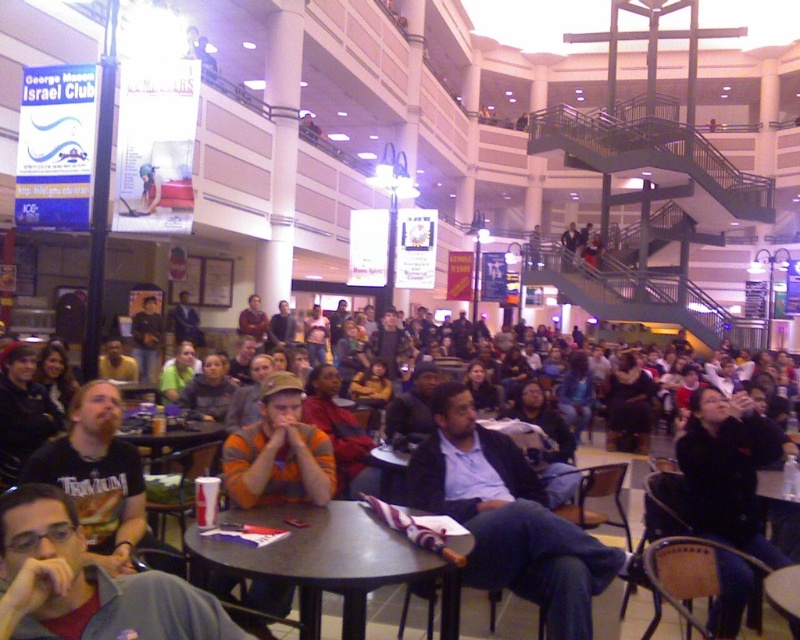
Does gray fabric shirt at lower left have a lesser height compared to black leather jacket at lower right?

Correct, gray fabric shirt at lower left is not as tall as black leather jacket at lower right.

Locate an element on the screen. The width and height of the screenshot is (800, 640). gray fabric shirt at lower left is located at coordinates (88, 582).

Image resolution: width=800 pixels, height=640 pixels. What do you see at coordinates (88, 582) in the screenshot?
I see `gray fabric shirt at lower left` at bounding box center [88, 582].

Find the location of `gray fabric shirt at lower left`. gray fabric shirt at lower left is located at coordinates (88, 582).

Does point (344, 609) come farther from viewer compared to point (725, 460)?

No, it is in front of (725, 460).

Consider the image. Can you confirm if metallic gray table at center is positioned to the right of black leather jacket at lower right?

Incorrect, metallic gray table at center is not on the right side of black leather jacket at lower right.

What do you see at coordinates (329, 561) in the screenshot?
I see `metallic gray table at center` at bounding box center [329, 561].

Find the location of `metallic gray table at center`. metallic gray table at center is located at coordinates (329, 561).

Can you confirm if light blue shirt at center is positioned above black leather jacket at lower right?

No.

Between light blue shirt at center and black leather jacket at lower right, which one appears on the left side from the viewer's perspective?

From the viewer's perspective, light blue shirt at center appears more on the left side.

You are a GUI agent. You are given a task and a screenshot of the screen. Output one action in this format:
    pyautogui.click(x=<x>, y=<y>)
    Task: Click on the light blue shirt at center
    The width and height of the screenshot is (800, 640).
    Given the screenshot: What is the action you would take?
    pyautogui.click(x=508, y=516)